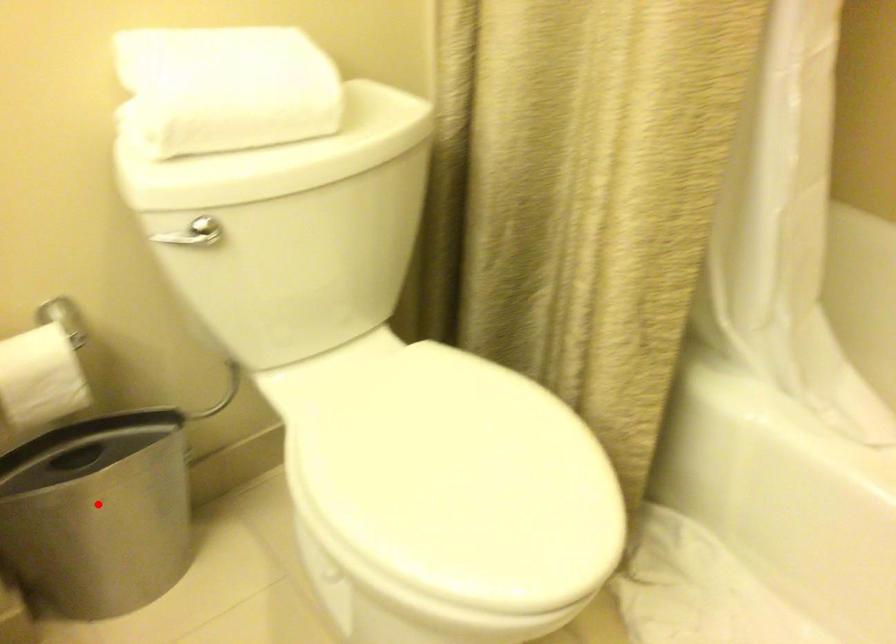
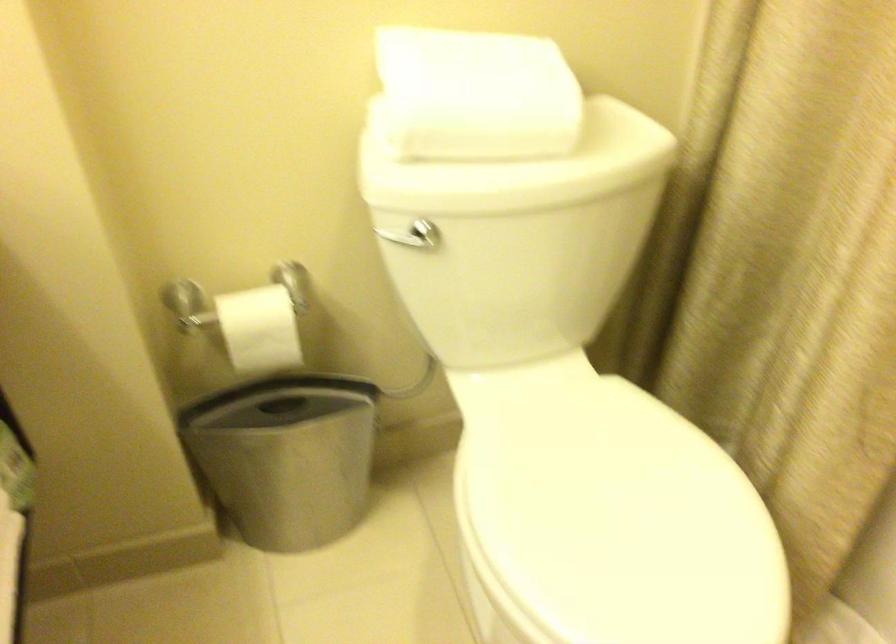
Find the pixel in the second image that matches the highlighted location in the first image.

(286, 456)